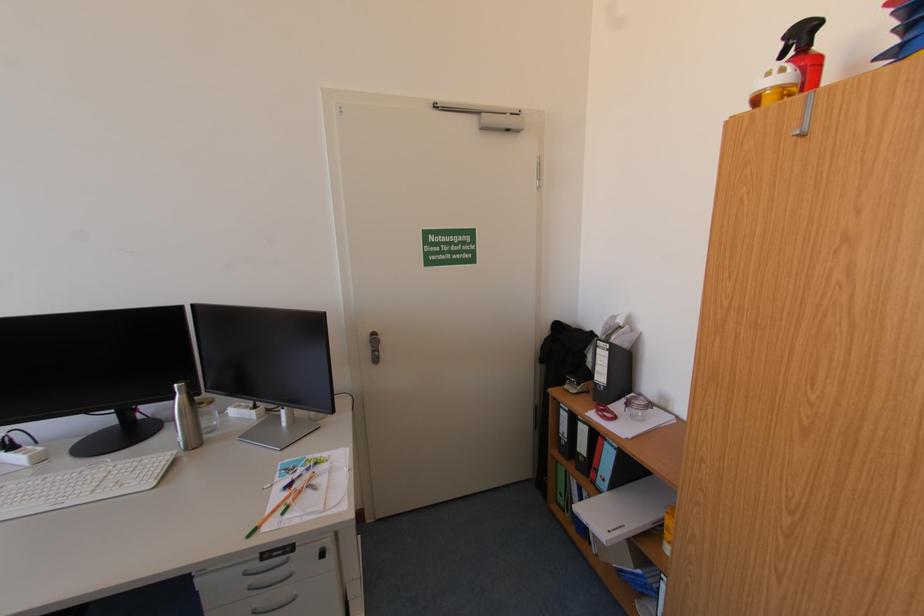
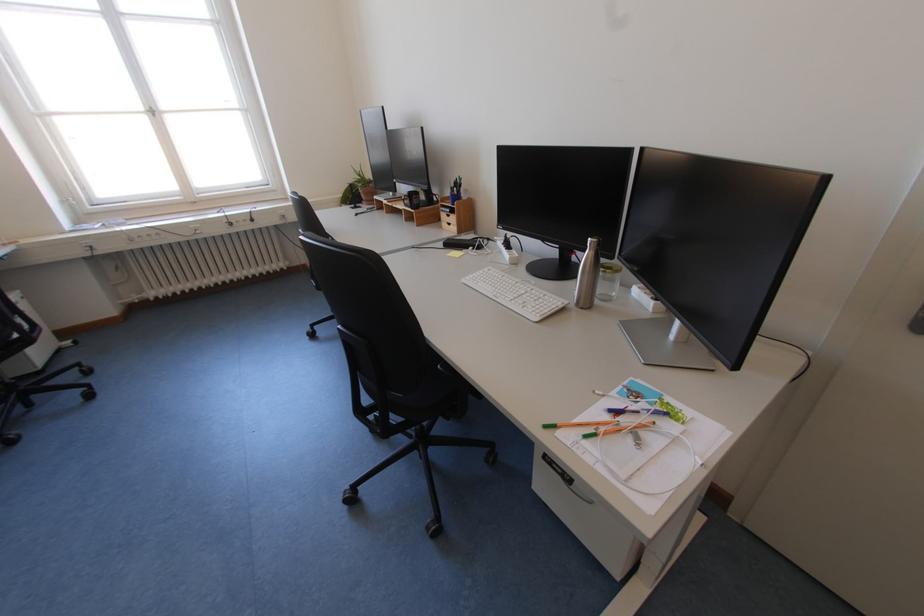
Question: I am providing you with two images of the same scene from different viewpoints. Please identify which objects are invisible in image2.

Choices:
 (A) wooden drawer pull
 (B) green pen
 (C) black mug
 (D) none of these

Answer: (D)